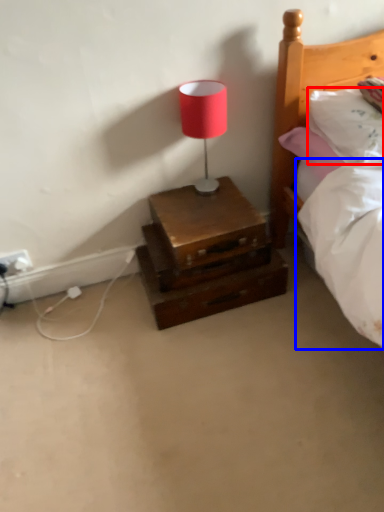
Question: Which object appears closest to the camera in this image, pillow (highlighted by a red box) or mattress (highlighted by a blue box)?

Choices:
 (A) pillow
 (B) mattress

Answer: (A)